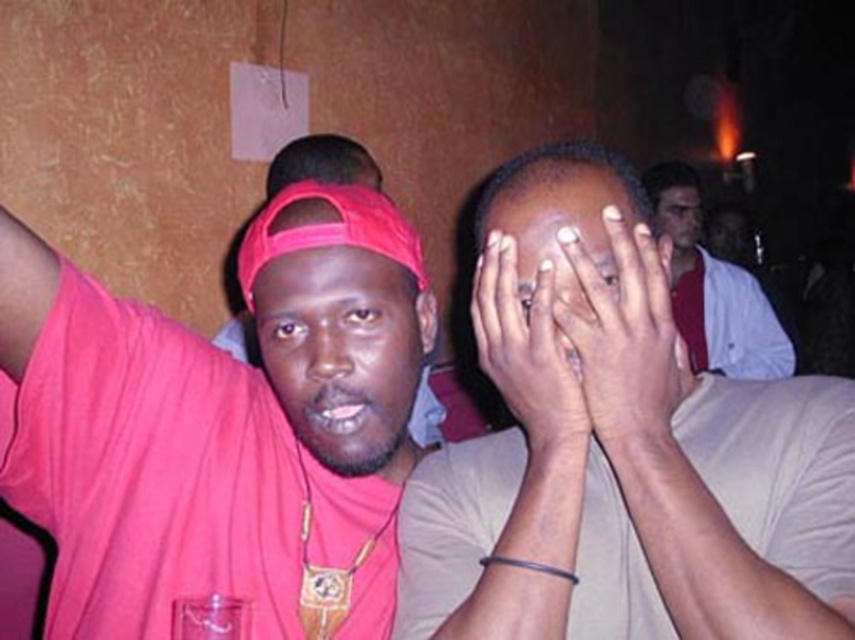
Question: Among these objects, which one is farthest from the camera?

Choices:
 (A) matte red cap at center
 (B) silver metallic ring at center

Answer: (A)

Question: Which point is closer to the camera taking this photo?

Choices:
 (A) (305, 260)
 (B) (538, 272)
 (C) (585, 328)
 (D) (684, 211)

Answer: (C)

Question: Which point is closer to the camera?

Choices:
 (A) (656, 276)
 (B) (699, 225)

Answer: (A)

Question: Is matte red cap at center to the right of white glossy shirt at upper right from the viewer's perspective?

Choices:
 (A) no
 (B) yes

Answer: (A)

Question: Does white matte ring at center appear on the left side of smooth skin at center?

Choices:
 (A) yes
 (B) no

Answer: (B)

Question: Is smooth beige shirt at center closer to the viewer compared to matte red cap at center?

Choices:
 (A) no
 (B) yes

Answer: (B)